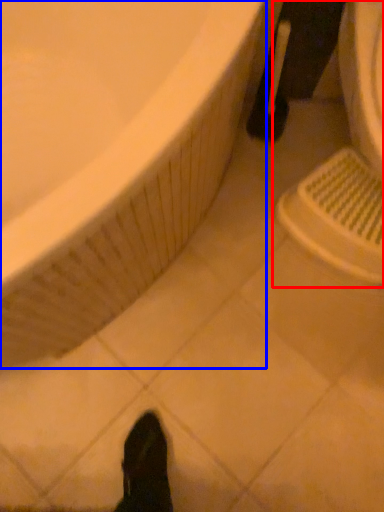
Question: Which object is closer to the camera taking this photo, sink (highlighted by a red box) or bathtub (highlighted by a blue box)?

Choices:
 (A) sink
 (B) bathtub

Answer: (B)